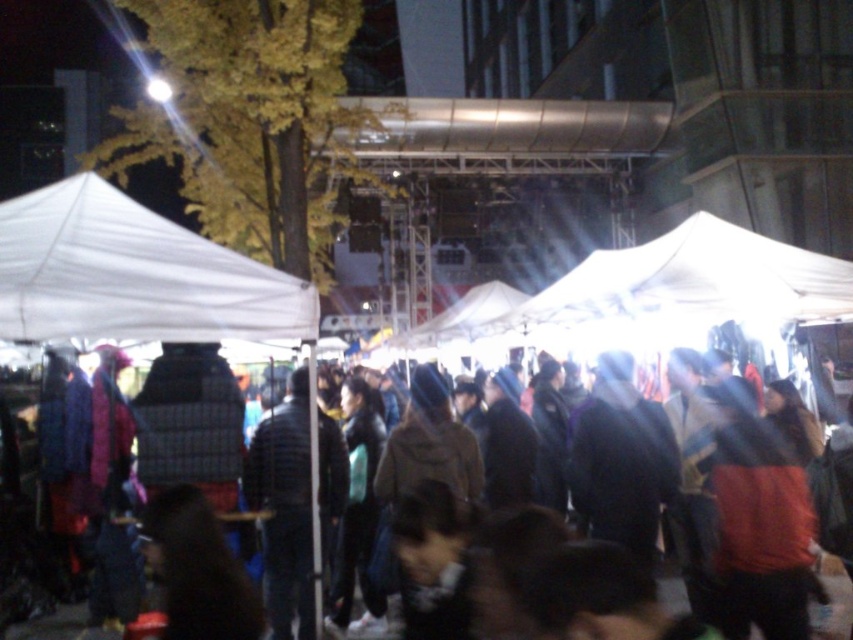
Is white fabric canopy at left bigger than brown fabric crowd at center?

Incorrect, white fabric canopy at left is not larger than brown fabric crowd at center.

Which is above, white fabric canopy at left or brown fabric crowd at center?

Positioned higher is white fabric canopy at left.

Is point (42, 218) farther from camera compared to point (386, 636)?

That is False.

Find the location of `white fabric canopy at left`. white fabric canopy at left is located at coordinates (132, 275).